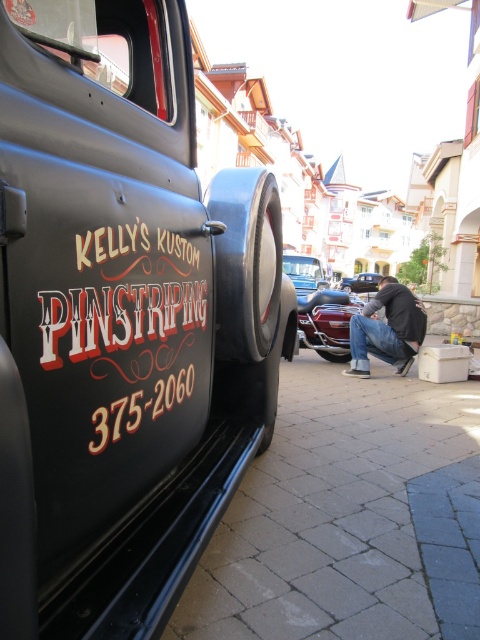
Between point (409, 307) and point (346, 355), which one is positioned behind?

The point (346, 355) is behind.

Does jeans at center have a lesser height compared to black rubber tire at lower center?

In fact, jeans at center may be taller than black rubber tire at lower center.

Is point (411, 316) positioned before point (346, 358)?

Yes, it is in front of point (346, 358).

You are a GUI agent. You are given a task and a screenshot of the screen. Output one action in this format:
    pyautogui.click(x=<x>, y=<y>)
    Task: Click on the jeans at center
    The image size is (480, 640).
    Given the screenshot: What is the action you would take?
    pyautogui.click(x=386, y=330)

Is jeans at center taller than shiny black car at center?

No, jeans at center is not taller than shiny black car at center.

Between point (368, 368) and point (347, 288), which one is positioned behind?

Point (347, 288)

Which is in front, point (420, 326) or point (360, 284)?

Point (420, 326) is in front.

The image size is (480, 640). Find the location of `jeans at center`. jeans at center is located at coordinates [x=386, y=330].

Is black pinstriping at center positioned before shiny chrome motorcycle at center?

That is True.

Is point (156, 365) farther from camera compared to point (313, 301)?

No, (156, 365) is closer to viewer.

The image size is (480, 640). I want to click on black pinstriping at center, so click(x=128, y=324).